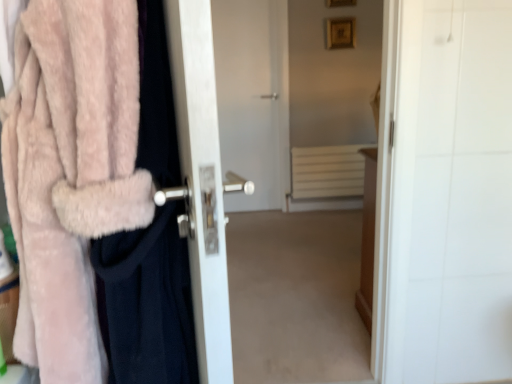
Question: Is point (117, 246) positioned closer to the camera than point (37, 14)?

Choices:
 (A) farther
 (B) closer

Answer: (A)

Question: Is fuzzy pink coat at left inside the boundaries of fuzzy pink coat at left, or outside?

Choices:
 (A) outside
 (B) inside

Answer: (B)

Question: Estimate the real-world distances between objects in this image. Which object is farther from the fuzzy pink coat at left?

Choices:
 (A) white matte radiator at center
 (B) fuzzy pink coat at left
 (C) white glossy door handle at left

Answer: (A)

Question: Which is farther from the fuzzy pink coat at left?

Choices:
 (A) white matte radiator at center
 (B) white glossy door handle at left
 (C) fuzzy pink coat at left

Answer: (A)